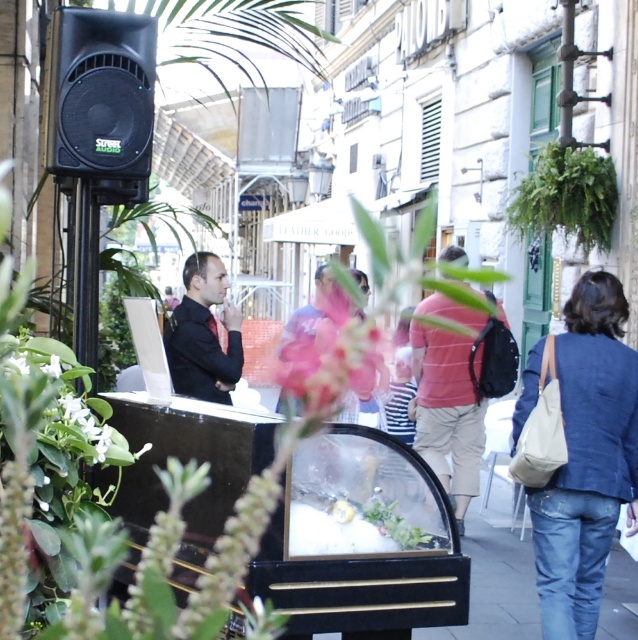
Question: Based on their relative distances, which object is farther from the white matte flower at center?

Choices:
 (A) black matte speaker at upper left
 (B) blue denim jeans at lower right
 (C) black smooth shirt at center
 (D) green leafy plant at upper right

Answer: (D)

Question: Considering the real-world distances, which object is farthest from the green leafy plant at upper right?

Choices:
 (A) blue denim jeans at lower right
 (B) black matte speaker at upper left
 (C) black smooth shirt at center

Answer: (B)

Question: Does blue denim jeans at lower right have a greater width compared to green leafy plant at upper right?

Choices:
 (A) no
 (B) yes

Answer: (A)

Question: Can you confirm if blue denim jeans at lower right is bigger than green leafy plant at upper right?

Choices:
 (A) no
 (B) yes

Answer: (A)

Question: Which of the following is the closest to the observer?

Choices:
 (A) (577, 337)
 (B) (221, 401)

Answer: (A)

Question: Considering the relative positions of black smooth shirt at center and pink matte flower at center in the image provided, where is black smooth shirt at center located with respect to pink matte flower at center?

Choices:
 (A) below
 (B) above

Answer: (B)